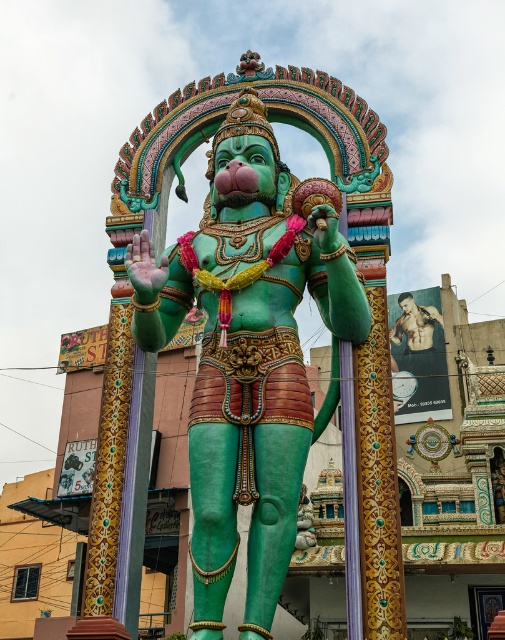
You are an art conservator examining the statue and need to determine the best vantage point for restoration work. Given the two points on the statue labeled as point (227, 116) and point (389, 333), which point is positioned closer to you?

Point (227, 116) is closer to the viewer than point (389, 333), so it is the closer point.

You are standing in front of an ornate archway and want to locate the green glossy statue at center. According to the coordinates provided, where exactly would you find it?

The green glossy statue at center is located at point coordinates of (247, 355).